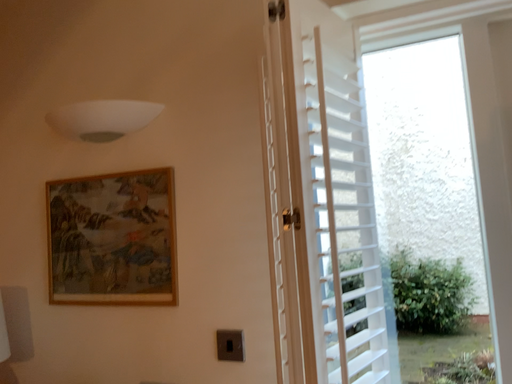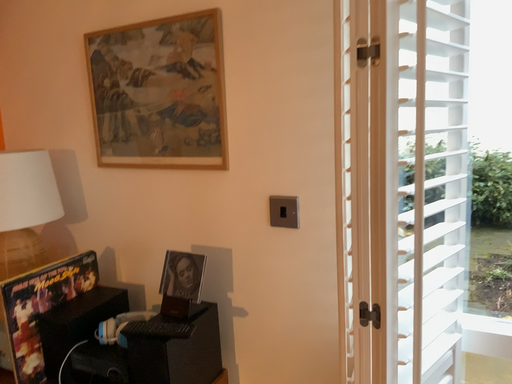
Question: How did the camera likely rotate when shooting the video?

Choices:
 (A) rotated right
 (B) rotated left

Answer: (B)